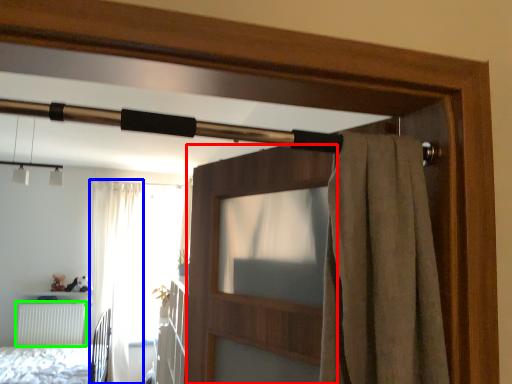
Question: Which object is positioned closest to screen door (highlighted by a red box)? Select from curtain (highlighted by a blue box) and radiator (highlighted by a green box).

Choices:
 (A) curtain
 (B) radiator

Answer: (A)